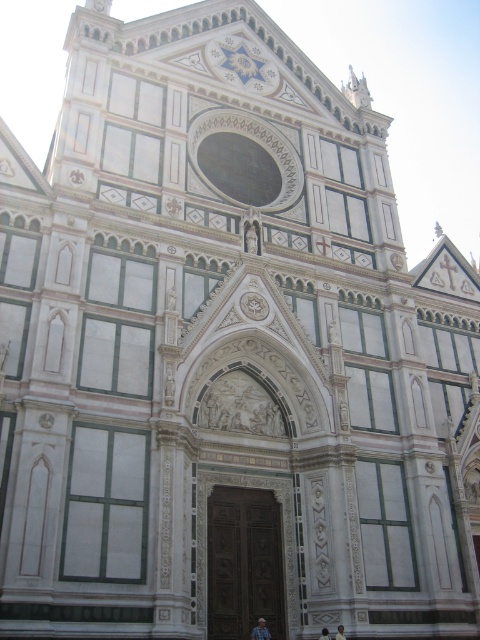
Does light blue denim jeans at lower center have a lesser width compared to light brown leather jacket at lower center?

No.

Is light blue denim jeans at lower center smaller than light brown leather jacket at lower center?

No, light blue denim jeans at lower center is not smaller than light brown leather jacket at lower center.

Does point (256, 637) come closer to viewer compared to point (340, 632)?

No, it is not.

Identify the location of light blue denim jeans at lower center. The height and width of the screenshot is (640, 480). (261, 630).

Who is lower down, light brown leather jacket at lower center or light brown wooden door at center?

light brown wooden door at center is below.

Does light brown leather jacket at lower center lie behind light brown wooden door at center?

No, it is not.

Image resolution: width=480 pixels, height=640 pixels. Describe the element at coordinates (339, 632) in the screenshot. I see `light brown leather jacket at lower center` at that location.

The width and height of the screenshot is (480, 640). Find the location of `light brown leather jacket at lower center`. light brown leather jacket at lower center is located at coordinates pos(339,632).

Between light blue denim jeans at lower center and light brown wooden door at center, which one has less height?

light brown wooden door at center

Between light blue denim jeans at lower center and light brown wooden door at center, which one appears on the right side from the viewer's perspective?

light brown wooden door at center is more to the right.

Is point (263, 637) positioned after point (324, 632)?

No, it is not.

I want to click on light blue denim jeans at lower center, so click(261, 630).